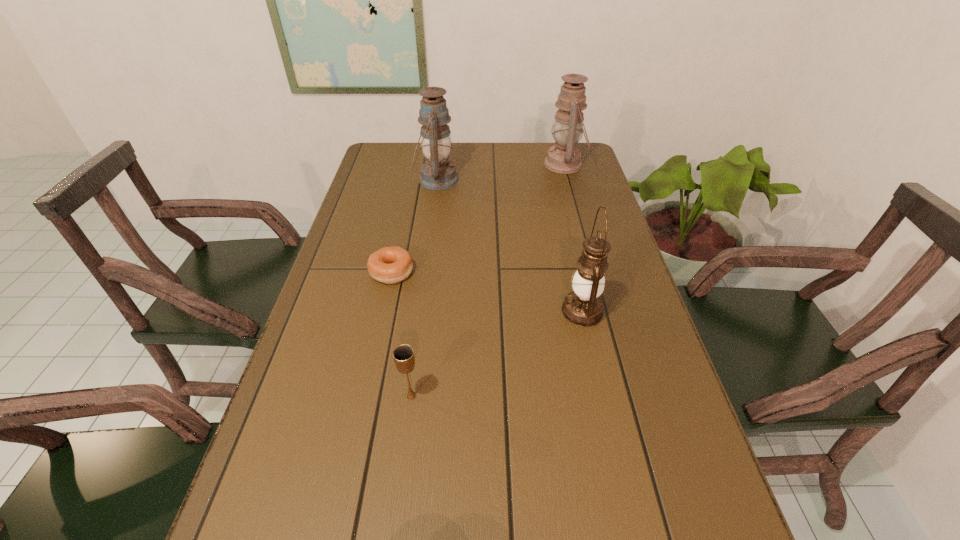
Find the location of `object that stands as the closest to the nearest oil lamp`. object that stands as the closest to the nearest oil lamp is located at coordinates (403, 355).

The image size is (960, 540). I want to click on object that stands as the third closest to the bagel, so click(x=583, y=307).

Locate an element on the screen. Image resolution: width=960 pixels, height=540 pixels. oil lamp that is the third closest to the shortest object is located at coordinates (564, 158).

Image resolution: width=960 pixels, height=540 pixels. I want to click on oil lamp that is the second closest to the leftmost oil lamp, so click(583, 307).

Where is `free point that satisfies the following two spatial constraints: 1. on the front side of the chalice; 2. on the right side of the leftmost oil lamp`? free point that satisfies the following two spatial constraints: 1. on the front side of the chalice; 2. on the right side of the leftmost oil lamp is located at coordinates (406, 396).

The image size is (960, 540). I want to click on free space that satisfies the following two spatial constraints: 1. on the front side of the shortest object; 2. on the left side of the nearest object, so click(x=365, y=396).